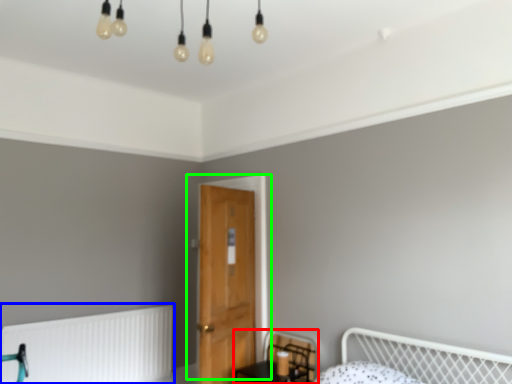
Question: Which object is positioned farthest from swivel chair (highlighted by a red box)? Select from radiator (highlighted by a blue box) and door (highlighted by a green box).

Choices:
 (A) radiator
 (B) door

Answer: (A)